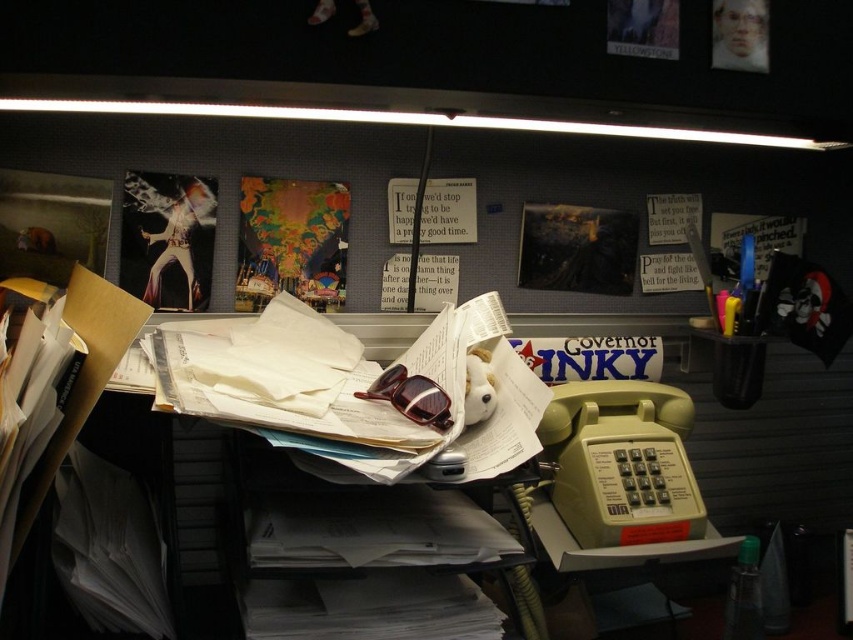
Who is positioned more to the left, beige plastic telephone at lower right or matte paper poster at center?

matte paper poster at center is more to the left.

Who is more forward, [608,552] or [386,193]?

Point [608,552] is more forward.

The width and height of the screenshot is (853, 640). Identify the location of beige plastic telephone at lower right. (618, 545).

From the picture: Between vibrant paper poster at center and matte black poster at center, which one has more height?

vibrant paper poster at center

Does vibrant paper poster at center have a lesser height compared to matte black poster at center?

No, vibrant paper poster at center is not shorter than matte black poster at center.

Who is more distant from viewer, (x=262, y=278) or (x=534, y=224)?

The point (x=534, y=224) is more distant.

Image resolution: width=853 pixels, height=640 pixels. What are the coordinates of `vibrant paper poster at center` in the screenshot? It's located at (291, 241).

Does shiny silver poster at upper left appear under matte black poster at center?

Indeed, shiny silver poster at upper left is positioned under matte black poster at center.

Can you confirm if shiny silver poster at upper left is wider than matte black poster at center?

Incorrect, shiny silver poster at upper left's width does not surpass matte black poster at center's.

The width and height of the screenshot is (853, 640). What do you see at coordinates (167, 237) in the screenshot?
I see `shiny silver poster at upper left` at bounding box center [167, 237].

Locate an element on the screen. The height and width of the screenshot is (640, 853). shiny silver poster at upper left is located at coordinates (167, 237).